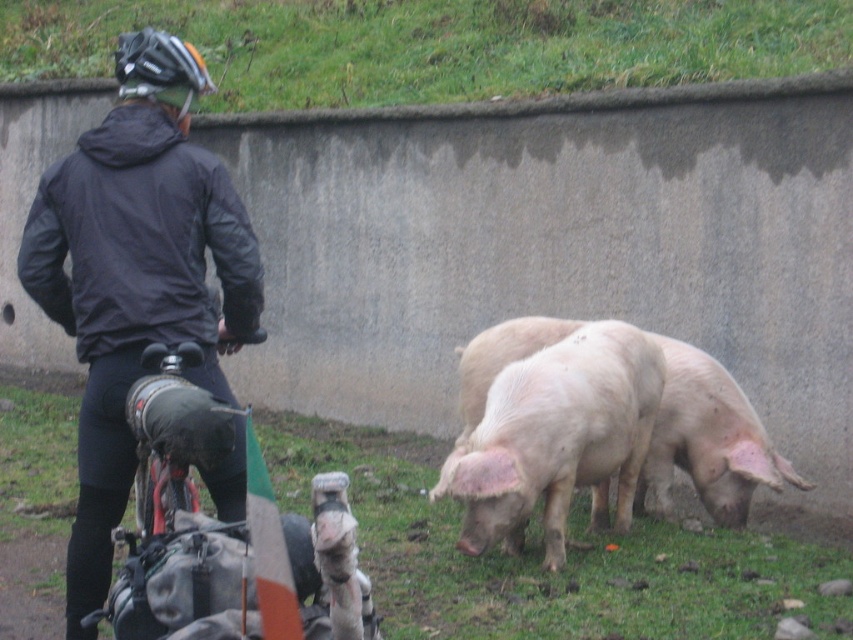
You are standing at the position of the cyclist looking towards the pigs. Which object is on the left side when you see the green grass at upper center and the pink smooth pig at center?

The green grass at upper center is positioned on the left side of the pink smooth pig at center, so the green grass at upper center is on the left.

You are a photographer trying to capture a clear shot of the green grass at upper center and the pink smooth pig at center. Based on their positions, which object is wider in the image?

The green grass at upper center might be wider than the pink smooth pig at center according to the scene description.